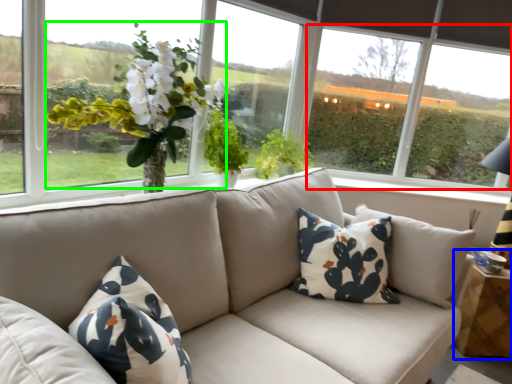
Question: Estimate the real-world distances between objects in this image. Which object is farther from window screen (highlighted by a red box), table (highlighted by a blue box) or floral arrangement (highlighted by a green box)?

Choices:
 (A) table
 (B) floral arrangement

Answer: (B)